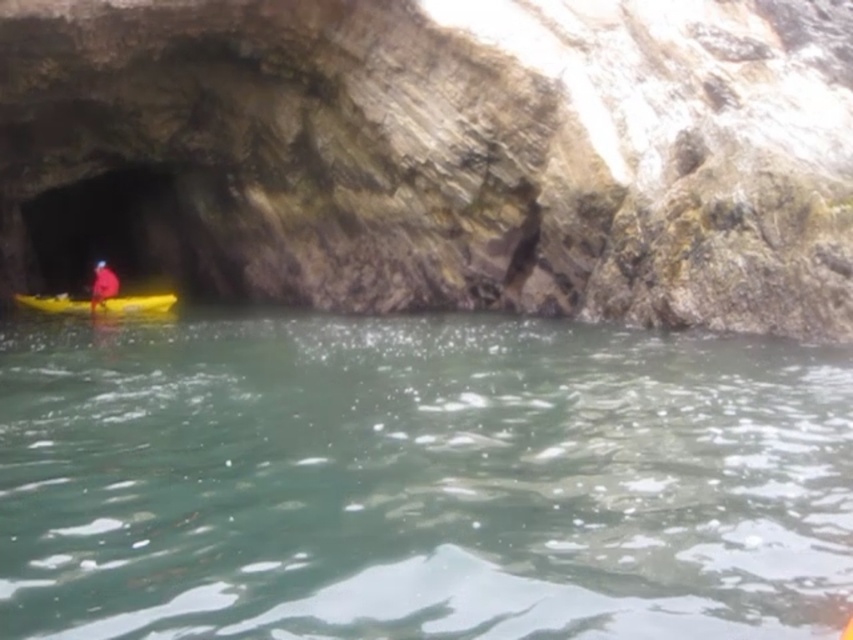
Question: Is yellow plastic canoe at left bigger than red fabric person at left?

Choices:
 (A) yes
 (B) no

Answer: (B)

Question: Can you confirm if rough stone cave at left is thinner than yellow plastic canoe at left?

Choices:
 (A) yes
 (B) no

Answer: (B)

Question: Is green smooth water at center wider than yellow plastic canoe at left?

Choices:
 (A) no
 (B) yes

Answer: (B)

Question: Considering the real-world distances, which object is farthest from the green smooth water at center?

Choices:
 (A) red fabric person at left
 (B) rough stone cave at left

Answer: (A)

Question: Which object appears farthest from the camera in this image?

Choices:
 (A) green smooth water at center
 (B) yellow plastic canoe at left
 (C) rough stone cave at left
 (D) red fabric person at left

Answer: (D)

Question: Which object appears closest to the camera in this image?

Choices:
 (A) yellow plastic canoe at left
 (B) green smooth water at center
 (C) red fabric person at left
 (D) rough stone cave at left

Answer: (B)